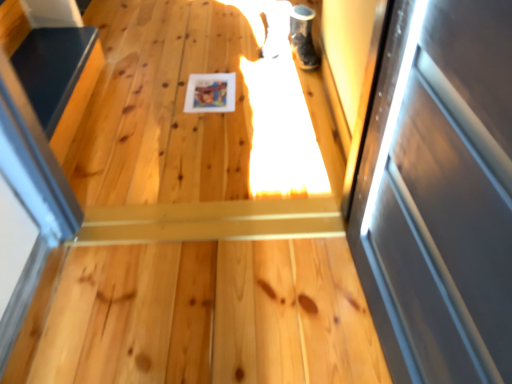
The image size is (512, 384). Find the location of `smooth black surface at left`. smooth black surface at left is located at coordinates (52, 64).

This screenshot has width=512, height=384. Describe the element at coordinates (52, 64) in the screenshot. I see `smooth black surface at left` at that location.

Find the location of a particular element. shiny black shoe at upper right is located at coordinates (303, 37).

What do you see at coordinates (303, 37) in the screenshot?
I see `shiny black shoe at upper right` at bounding box center [303, 37].

Locate an element on the screen. smooth black surface at left is located at coordinates (52, 64).

In the scene shown: Based on their positions, is shiny black shoe at upper right located to the left or right of smooth black surface at left?

Based on their positions, shiny black shoe at upper right is located to the right of smooth black surface at left.

Which object is more forward, shiny black shoe at upper right or smooth black surface at left?

smooth black surface at left is in front.

Which is behind, point (300, 42) or point (68, 97)?

Point (300, 42)

From the image's perspective, which one is positioned higher, shiny black shoe at upper right or smooth black surface at left?

shiny black shoe at upper right, from the image's perspective.

From a real-world perspective, is shiny black shoe at upper right above or below smooth black surface at left?

In terms of real-world spatial position, shiny black shoe at upper right is above smooth black surface at left.

Is shiny black shoe at upper right wider than smooth black surface at left?

Incorrect, the width of shiny black shoe at upper right does not surpass that of smooth black surface at left.

Considering the sizes of objects shiny black shoe at upper right and smooth black surface at left in the image provided, who is taller, shiny black shoe at upper right or smooth black surface at left?

shiny black shoe at upper right.

Between shiny black shoe at upper right and smooth black surface at left, which one has smaller size?

Smaller between the two is shiny black shoe at upper right.

Is shiny black shoe at upper right not within smooth black surface at left?

shiny black shoe at upper right is positioned outside smooth black surface at left.

Is shiny black shoe at upper right beside smooth black surface at left?

shiny black shoe at upper right and smooth black surface at left are clearly separated.

Is smooth black surface at left at the back of shiny black shoe at upper right?

That's not correct — shiny black shoe at upper right is not looking away from smooth black surface at left.

How distant is shiny black shoe at upper right from smooth black surface at left?

A distance of 3.39 feet exists between shiny black shoe at upper right and smooth black surface at left.

In order to click on stairs below the shiny black shoe at upper right (from a real-world perspective) in this screenshot , I will do `click(52, 64)`.

Which object is positioned more to the left, smooth black surface at left or shiny black shoe at upper right?

smooth black surface at left.

Which object is more forward, smooth black surface at left or shiny black shoe at upper right?

smooth black surface at left is in front.

Is point (49, 138) closer to viewer compared to point (304, 27)?

Yes.

From the image's perspective, between smooth black surface at left and shiny black shoe at upper right, who is located below?

smooth black surface at left is shown below in the image.

From a real-world perspective, who is located higher, smooth black surface at left or shiny black shoe at upper right?

shiny black shoe at upper right, from a real-world perspective.

Between smooth black surface at left and shiny black shoe at upper right, which one has smaller width?

shiny black shoe at upper right.

Does smooth black surface at left have a greater height compared to shiny black shoe at upper right?

Incorrect, the height of smooth black surface at left is not larger of that of shiny black shoe at upper right.

Can you confirm if smooth black surface at left is smaller than shiny black shoe at upper right?

Actually, smooth black surface at left might be larger than shiny black shoe at upper right.

Is smooth black surface at left completely or partially outside of shiny black shoe at upper right?

Absolutely, smooth black surface at left is external to shiny black shoe at upper right.

Would you say smooth black surface at left is a long distance from shiny black shoe at upper right?

smooth black surface at left is far away from shiny black shoe at upper right.

Is smooth black surface at left oriented away from shiny black shoe at upper right?

No, shiny black shoe at upper right is not at the back of smooth black surface at left.

How different are the orientations of smooth black surface at left and shiny black shoe at upper right in degrees?

There is a 90-degree angle between the facing directions of smooth black surface at left and shiny black shoe at upper right.

I want to click on shoe behind the smooth black surface at left, so click(x=303, y=37).

Locate an element on the screen. shoe located above the smooth black surface at left (from the image's perspective) is located at coordinates (303, 37).

Find the location of a particular element. stairs lying on the left of shiny black shoe at upper right is located at coordinates pyautogui.click(x=52, y=64).